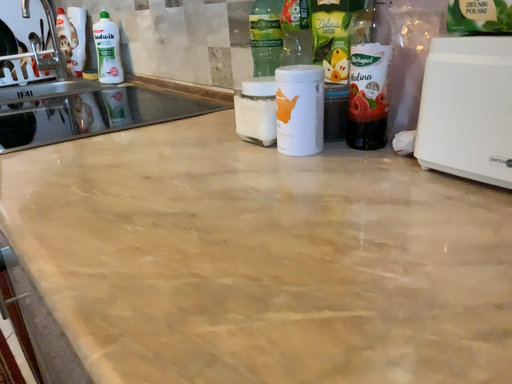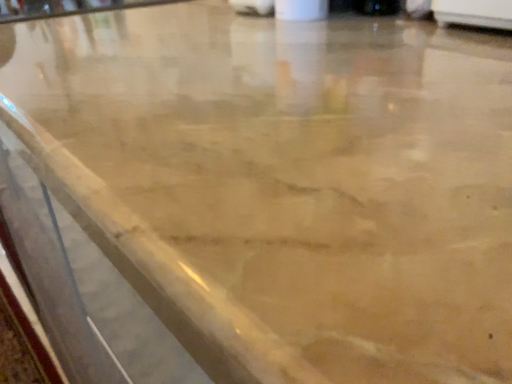
Question: Which way did the camera rotate in the video?

Choices:
 (A) rotated downward
 (B) rotated upward

Answer: (A)